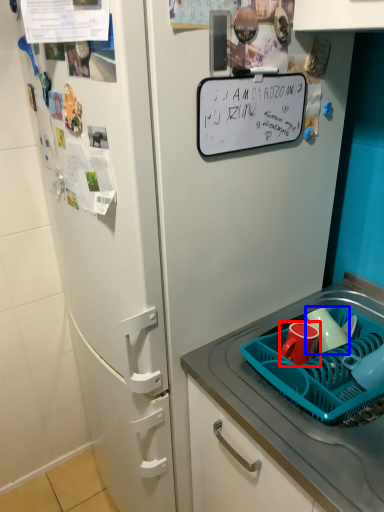
Question: Which of the following is the farthest to the observer, coffee cup (highlighted by a red box) or mug (highlighted by a blue box)?

Choices:
 (A) coffee cup
 (B) mug

Answer: (B)